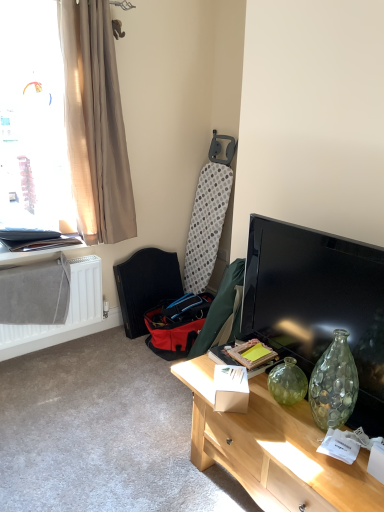
Question: Is white matte radiator at lower left inside or outside of beige fabric curtain at left?

Choices:
 (A) outside
 (B) inside

Answer: (A)

Question: Looking at the image, does white matte radiator at lower left seem bigger or smaller compared to beige fabric curtain at left?

Choices:
 (A) small
 (B) big

Answer: (A)

Question: Considering the real-world distances, which object is closest to the black glossy tv at right?

Choices:
 (A) white matte radiator at lower left
 (B) translucent glass vase at center right
 (C) red fabric swivel chair at lower left
 (D) metallic silver frame at left
 (E) beige fabric curtain at left

Answer: (B)

Question: Considering the real-world distances, which object is closest to the beige fabric curtain at left?

Choices:
 (A) white matte radiator at lower left
 (B) metallic silver frame at left
 (C) translucent beige curtain at upper left
 (D) black glossy tv at right
 (E) red fabric swivel chair at lower left

Answer: (C)